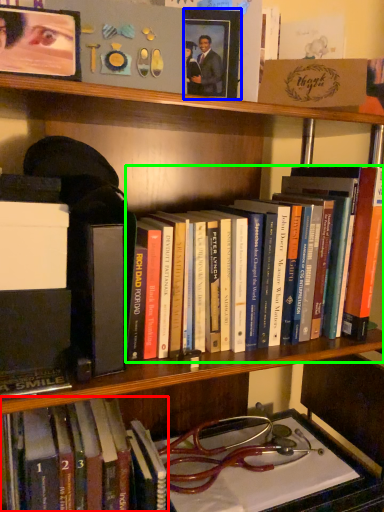
Question: Which object is the closest to the book (highlighted by a red box)? Choose among these: picture frame (highlighted by a blue box) or book (highlighted by a green box).

Choices:
 (A) picture frame
 (B) book

Answer: (B)